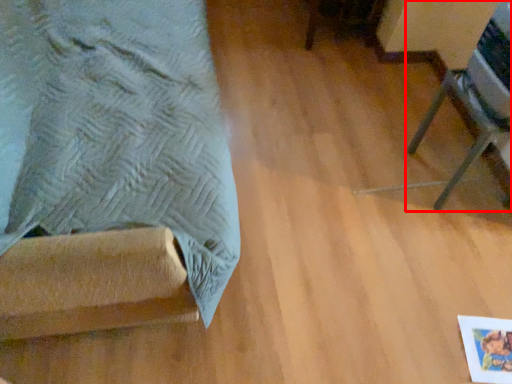
Question: Observing the image, what is the correct spatial positioning of furniture (annotated by the red box) in reference to furniture?

Choices:
 (A) left
 (B) right

Answer: (B)